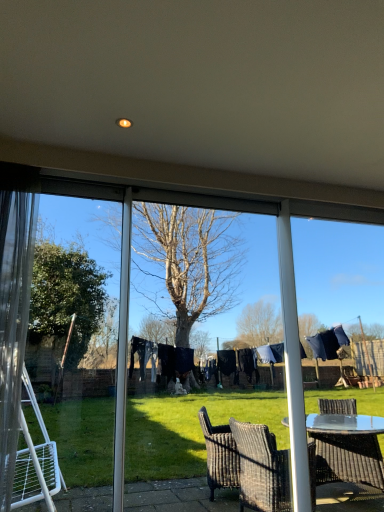
Identify the location of free space above transparent glass screen door at left, the second screen door from the right (from a real-world perspective). (66, 185).